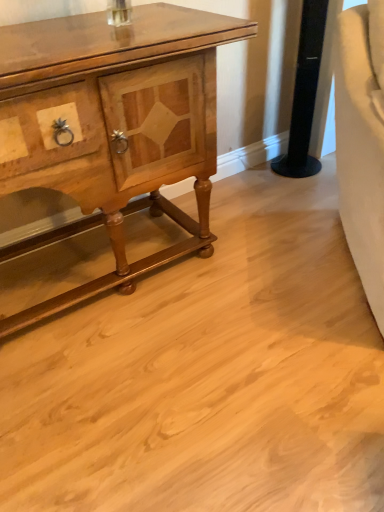
Where is `vacant space to the right of wooden polished cabinet at left`? Image resolution: width=384 pixels, height=512 pixels. vacant space to the right of wooden polished cabinet at left is located at coordinates (271, 271).